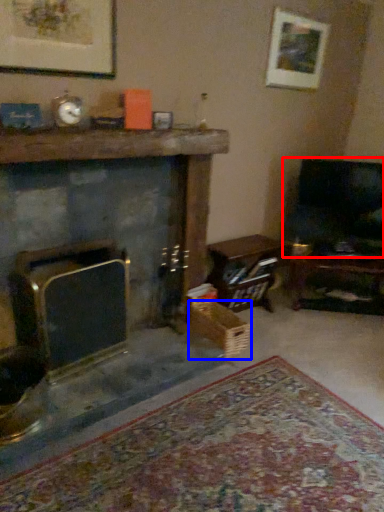
Question: Which point is further to the camera, rocking chair (highlighted by a red box) or crate (highlighted by a blue box)?

Choices:
 (A) rocking chair
 (B) crate

Answer: (A)